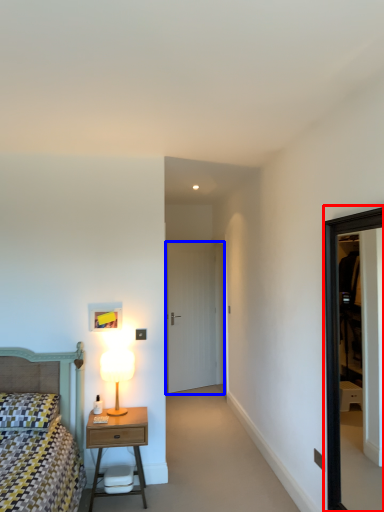
Question: Which of the following is the farthest to the observer, window (highlighted by a red box) or door (highlighted by a blue box)?

Choices:
 (A) window
 (B) door

Answer: (B)